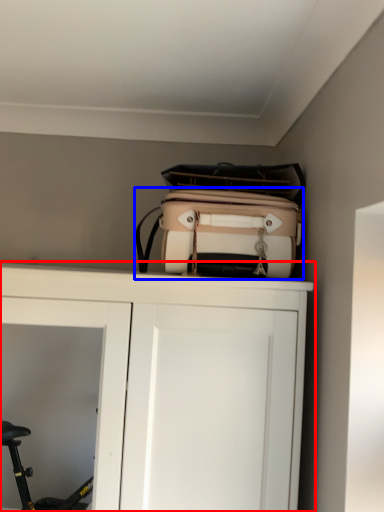
Question: Which object appears farthest to the camera in this image, cupboard (highlighted by a red box) or luggage and bags (highlighted by a blue box)?

Choices:
 (A) cupboard
 (B) luggage and bags

Answer: (B)